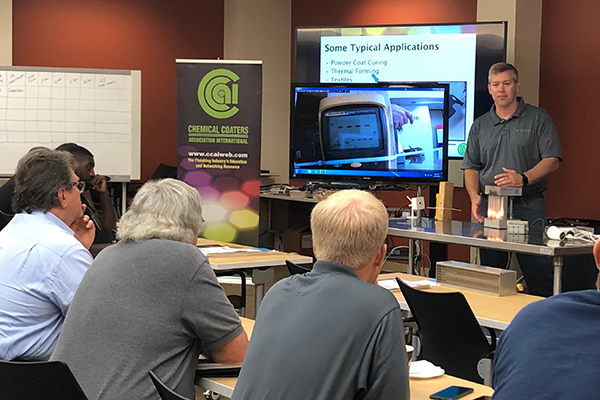
This screenshot has width=600, height=400. I want to click on steel table, so click(469, 232).